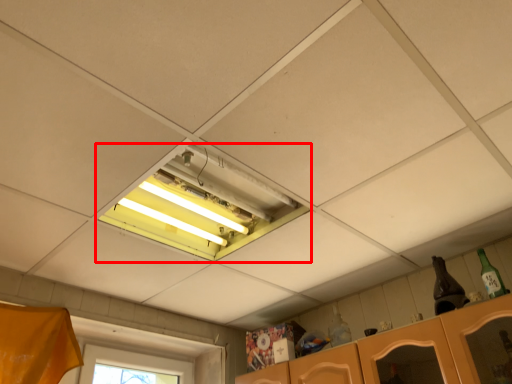
Question: Where is window (annotated by the red box) located in relation to bottle in the image?

Choices:
 (A) right
 (B) left

Answer: (B)